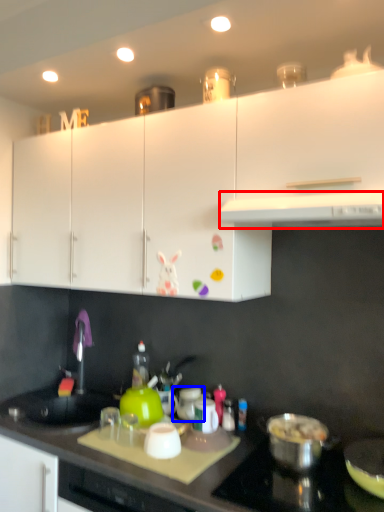
Question: Which point is further to the camera, exhaust hood (highlighted by a red box) or appliance (highlighted by a blue box)?

Choices:
 (A) exhaust hood
 (B) appliance

Answer: (B)